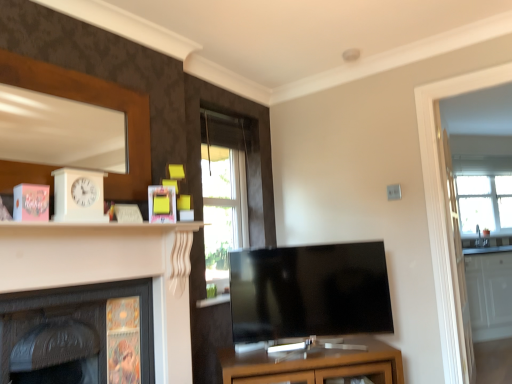
Question: Is white glossy fireplace at left, positioned as the first fireplace in right-to-left order, inside or outside of dark wood fireplace at lower left, placed as the first fireplace when sorted from left to right?

Choices:
 (A) outside
 (B) inside

Answer: (A)

Question: From a real-world perspective, is white glossy fireplace at left, positioned as the first fireplace in right-to-left order, physically located above or below dark wood fireplace at lower left, which is the 2th fireplace from right to left?

Choices:
 (A) below
 (B) above

Answer: (B)

Question: Which object is positioned closest to the yellow matte picture frame at upper center?

Choices:
 (A) dark wood fireplace at lower left, which is the 2th fireplace from right to left
 (B) black glossy tv at center
 (C) clear glass window at right, placed as the 1th window when sorted from back to front
 (D) clear glass window at center, marked as the 1th window in a front-to-back arrangement
 (E) transparent glass door at right

Answer: (A)

Question: Which is nearer to the clear glass window at right, the second window when ordered from front to back?

Choices:
 (A) dark wood fireplace at lower left, placed as the first fireplace when sorted from left to right
 (B) matte brown cabinet at center
 (C) black glossy tv at center
 (D) transparent glass door at right
 (E) white glossy fireplace at left, which is the 2th fireplace from left to right

Answer: (D)